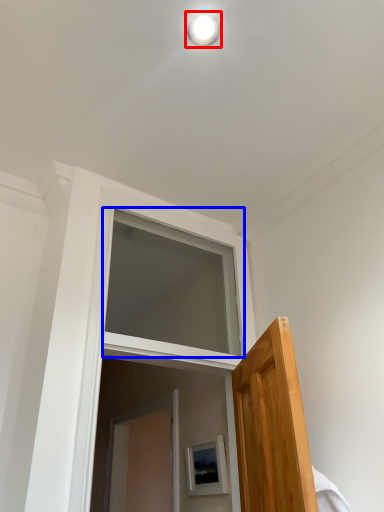
Question: Which of the following is the closest to the observer, light fixture (highlighted by a red box) or window (highlighted by a blue box)?

Choices:
 (A) light fixture
 (B) window

Answer: (A)